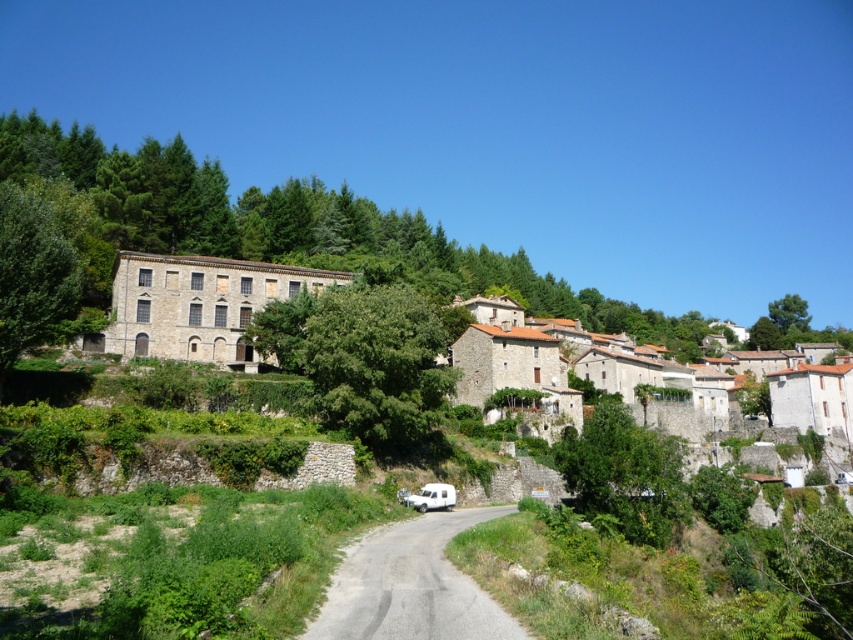
Question: Can you confirm if green leafy tree at center-right is positioned to the right of green leafy tree at left?

Choices:
 (A) no
 (B) yes

Answer: (B)

Question: Which point is closer to the camera taking this photo?

Choices:
 (A) (451, 499)
 (B) (589, 484)

Answer: (B)

Question: Which is farther from the green leafy tree at left?

Choices:
 (A) green leafy tree at center-right
 (B) gray asphalt road at center
 (C) white matte van at center
 (D) green leafy tree at center

Answer: (A)

Question: Which point appears closest to the camera in this image?

Choices:
 (A) (618, 419)
 (B) (440, 513)

Answer: (B)

Question: In this image, where is gray asphalt road at center located relative to green leafy tree at center-right?

Choices:
 (A) left
 (B) right

Answer: (A)

Question: Considering the relative positions of gray asphalt road at center and green leafy tree at left in the image provided, where is gray asphalt road at center located with respect to green leafy tree at left?

Choices:
 (A) left
 (B) right

Answer: (B)